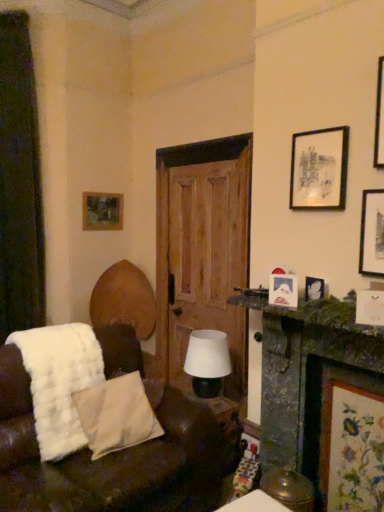
Question: Considering the positions of white fluffy blanket at lower left and white soft pillow at lower left in the image, is white fluffy blanket at lower left wider or thinner than white soft pillow at lower left?

Choices:
 (A) thin
 (B) wide

Answer: (B)

Question: In terms of size, does white fluffy blanket at lower left appear bigger or smaller than white soft pillow at lower left?

Choices:
 (A) big
 (B) small

Answer: (A)

Question: Which object is positioned farthest from the white fluffy blanket at lower left?

Choices:
 (A) green mossy fireplace at right
 (B) wooden picture frame at upper left, which is counted as the second picture frame, starting from the top
 (C) black matte picture frame at upper right, which appears as the fourth picture frame when viewed from the back
 (D) dark green fabric curtain at left
 (E) floral fabric picture frame at lower right, which is the 1th picture frame from right to left

Answer: (B)

Question: Based on their relative distances, which object is farther from the dark green fabric curtain at left?

Choices:
 (A) white soft pillow at lower left
 (B) green mossy fireplace at right
 (C) white matte table lamp at center
 (D) matte white picture frame at upper right, acting as the 4th picture frame starting from the left
 (E) black matte picture frame at upper right, the third picture frame when ordered from left to right

Answer: (D)